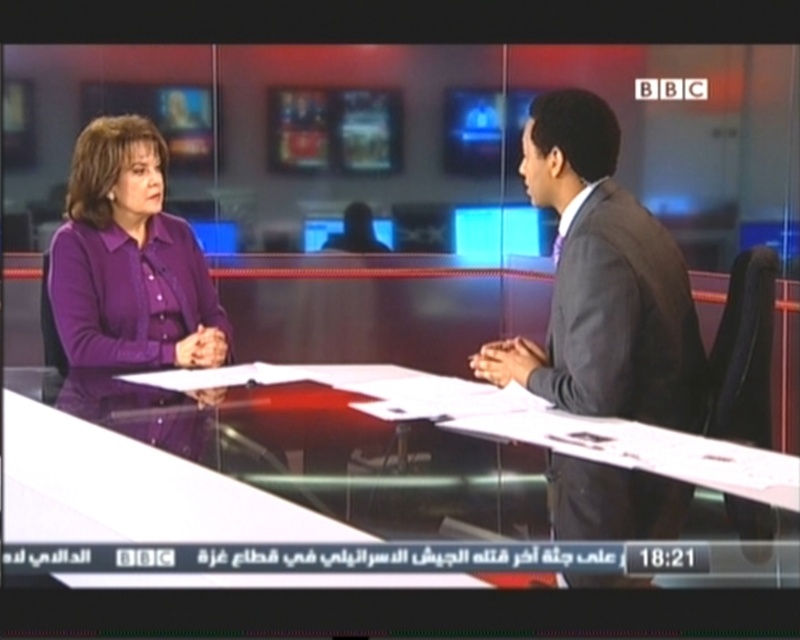
You are a camera operator adjusting the focus for a closeup shot. There are two points in the scene you need to focus on, point (96, 536) and point (614, 326). Which point should you focus on first to ensure the subject closest to the camera is in sharp focus?

Point (96, 536) is closer to the camera than point (614, 326), so you should focus on point (96, 536) first to ensure the subject closest to the camera is in sharp focus.